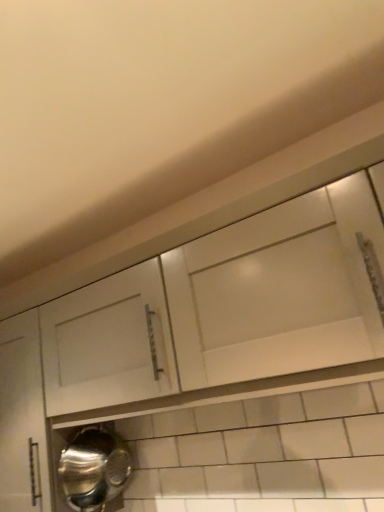
Question: Looking at their shapes, would you say white matte cabinet at upper center is wider or thinner than shiny metallic water heater at lower left?

Choices:
 (A) wide
 (B) thin

Answer: (A)

Question: Considering the positions of white matte cabinet at upper center and shiny metallic water heater at lower left in the image, is white matte cabinet at upper center bigger or smaller than shiny metallic water heater at lower left?

Choices:
 (A) small
 (B) big

Answer: (B)

Question: From the image's perspective, is white matte cabinet at upper center located above or below shiny metallic water heater at lower left?

Choices:
 (A) below
 (B) above

Answer: (B)

Question: Considering the positions of shiny metallic water heater at lower left and white matte cabinet at upper center in the image, is shiny metallic water heater at lower left wider or thinner than white matte cabinet at upper center?

Choices:
 (A) thin
 (B) wide

Answer: (A)

Question: From the image's perspective, is shiny metallic water heater at lower left positioned above or below white matte cabinet at upper center?

Choices:
 (A) below
 (B) above

Answer: (A)

Question: In terms of height, does shiny metallic water heater at lower left look taller or shorter compared to white matte cabinet at upper center?

Choices:
 (A) short
 (B) tall

Answer: (A)

Question: From a real-world perspective, is shiny metallic water heater at lower left physically located above or below white matte cabinet at upper center?

Choices:
 (A) below
 (B) above

Answer: (A)